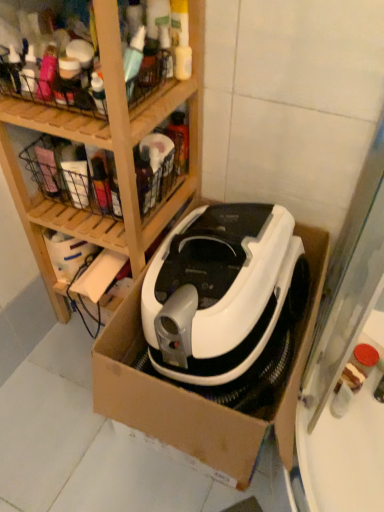
Question: Is point (122, 90) positioned closer to the camera than point (155, 339)?

Choices:
 (A) farther
 (B) closer

Answer: (B)

Question: In terms of width, does wooden at upper left look wider or thinner when compared to white plastic vacuum cleaner at center?

Choices:
 (A) wide
 (B) thin

Answer: (B)

Question: Estimate the real-world distances between objects in this image. Which object is farther from the white plastic vacuum cleaner at center?

Choices:
 (A) metallic wire basket at upper left
 (B) wooden at upper left
 (C) white cardboard box at center

Answer: (A)

Question: Which is farther from the metallic wire basket at upper left?

Choices:
 (A) wooden at upper left
 (B) white cardboard box at center
 (C) white plastic vacuum cleaner at center

Answer: (B)